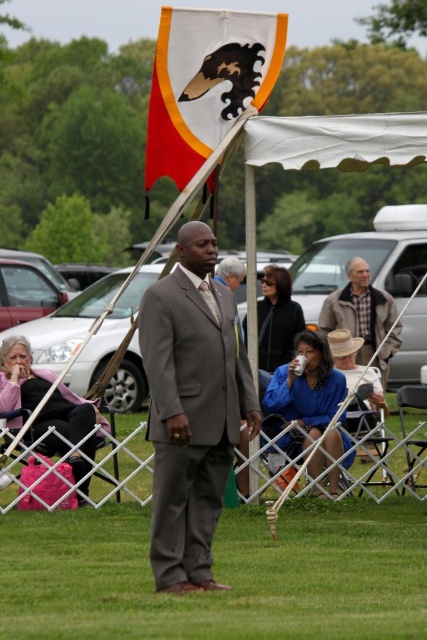
Question: Does white fabric flag with black and gold design at upper center come in front of pink fabric bag at lower left?

Choices:
 (A) yes
 (B) no

Answer: (B)

Question: Among these objects, which one is nearest to the camera?

Choices:
 (A) white fabric flag with black and gold design at upper center
 (B) pink fabric bag at lower left
 (C) matte gray suit at center

Answer: (C)

Question: Estimate the real-world distances between objects in this image. Which object is closer to the blue fabric shirt at lower center?

Choices:
 (A) pink fabric bag at lower left
 (B) plaid wool jacket at center
 (C) matte gray suit at center
 (D) white fabric flag with black and gold design at upper center

Answer: (A)

Question: Does matte gray suit at center appear on the right side of pink fabric bag at lower left?

Choices:
 (A) yes
 (B) no

Answer: (A)

Question: Is matte gray suit at center further to camera compared to plaid wool jacket at center?

Choices:
 (A) no
 (B) yes

Answer: (A)

Question: Which of the following is the farthest from the observer?

Choices:
 (A) plaid wool jacket at center
 (B) blue fabric shirt at lower center
 (C) pink fabric bag at lower left

Answer: (A)